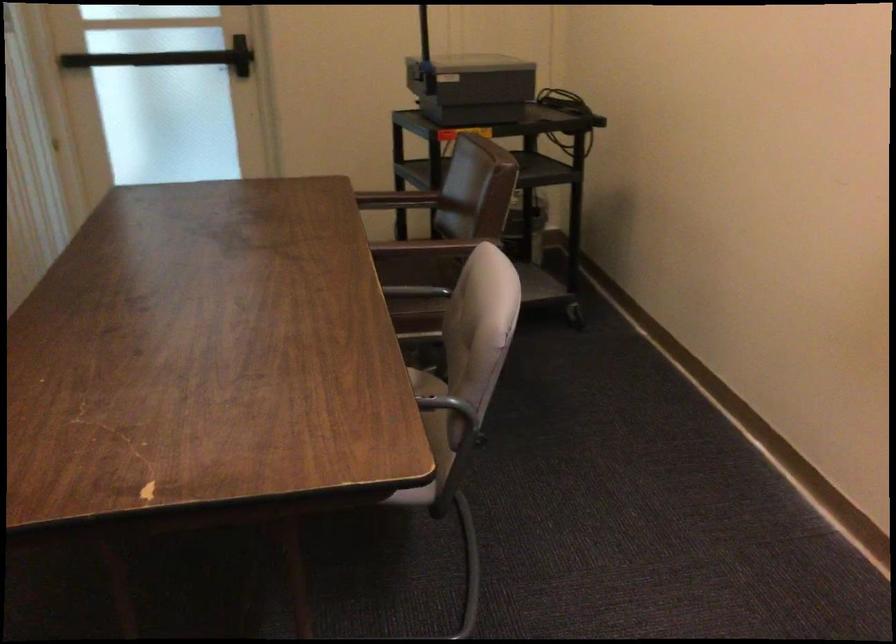
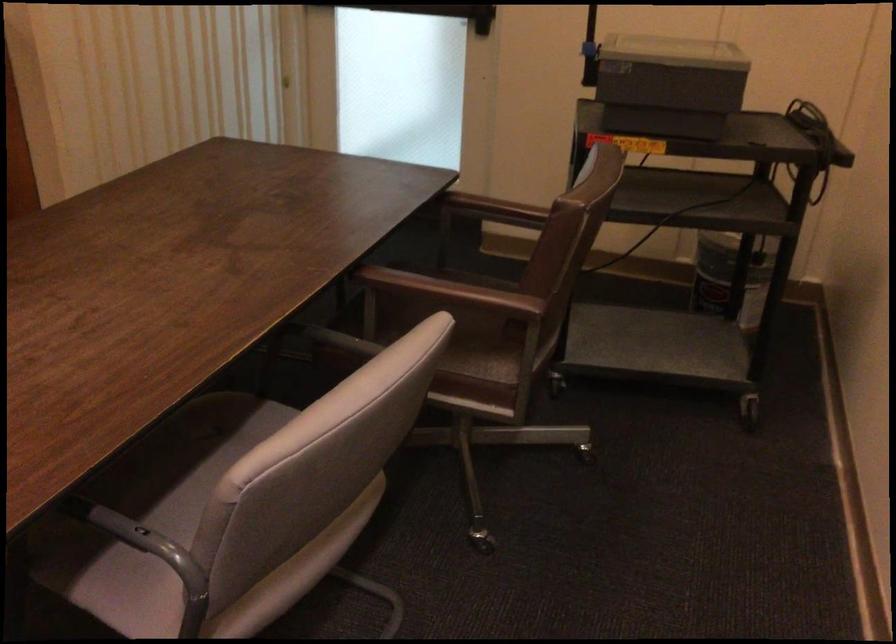
Find the pixel in the second image that matches the point at 478,82 in the first image.

(668, 84)